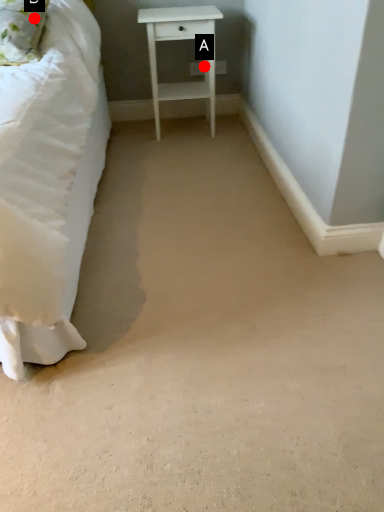
Question: Two points are circled on the image, labeled by A and B beside each circle. Which point is closer to the camera?

Choices:
 (A) A is closer
 (B) B is closer

Answer: (B)